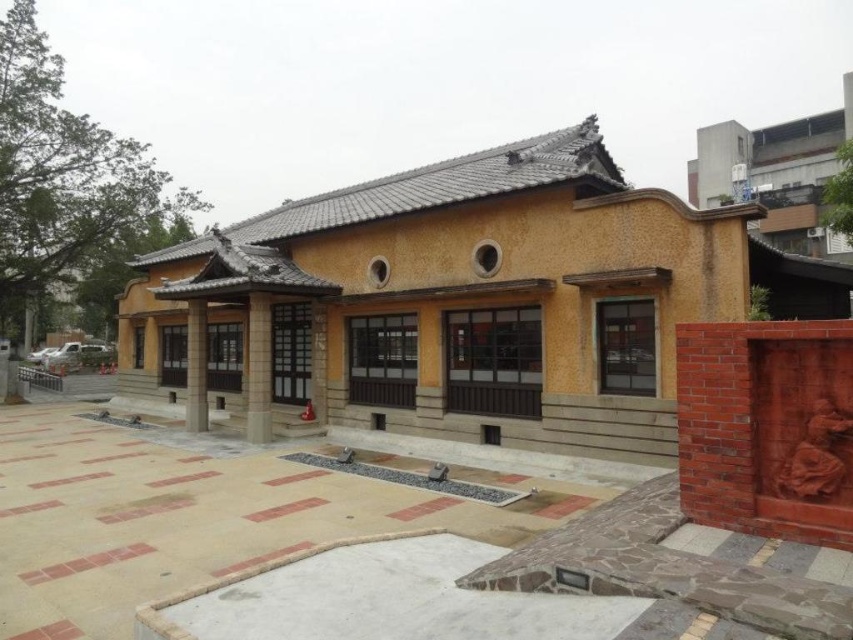
Question: Does smooth stone column at center have a smaller size compared to smooth concrete pillar at center?

Choices:
 (A) yes
 (B) no

Answer: (A)

Question: Does smooth stone column at center lie in front of smooth concrete pillar at center?

Choices:
 (A) no
 (B) yes

Answer: (B)

Question: Which object appears farthest from the camera in this image?

Choices:
 (A) smooth stone column at center
 (B) smooth concrete pillar at center

Answer: (B)

Question: Is smooth stone column at center thinner than smooth concrete pillar at center?

Choices:
 (A) yes
 (B) no

Answer: (A)

Question: Which object appears farthest from the camera in this image?

Choices:
 (A) smooth concrete pillar at center
 (B) smooth stone column at center

Answer: (A)